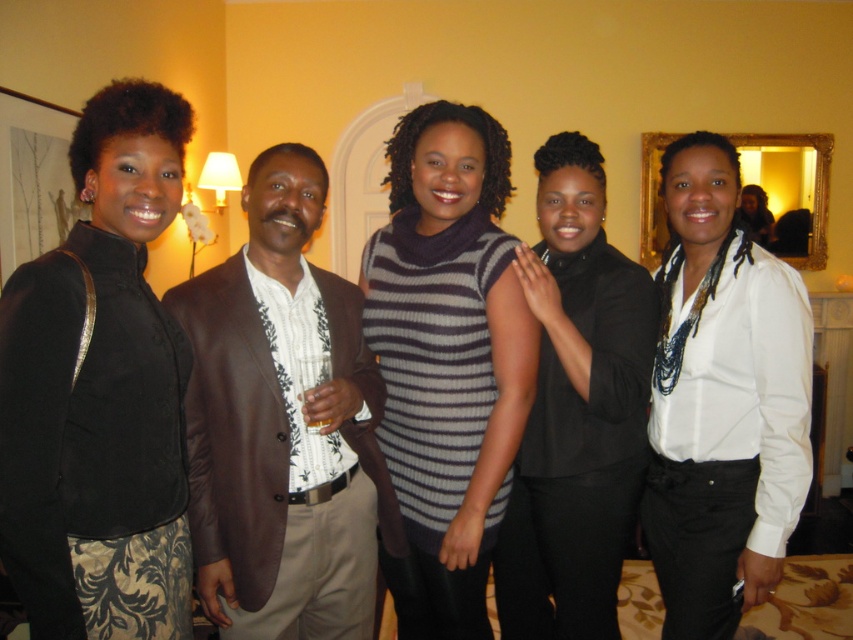
Question: Does striped knit dress at center have a lesser width compared to white silk blouse at center?

Choices:
 (A) yes
 (B) no

Answer: (B)

Question: Which point is farther to the camera?

Choices:
 (A) black matte shirt at center
 (B) white silk blouse at center
 (C) striped knit dress at center

Answer: (B)

Question: Which point appears farthest from the camera in this image?

Choices:
 (A) (622, 525)
 (B) (672, 248)
 (C) (764, 220)

Answer: (C)

Question: Which of the following is the closest to the observer?

Choices:
 (A) brown leather jacket at center
 (B) white silk blouse at center
 (C) black velvet jacket at left

Answer: (C)

Question: In this image, where is brown leather jacket at center located relative to white silk blouse at center?

Choices:
 (A) below
 (B) above

Answer: (A)

Question: Is white satin blouse at center to the left of black matte shirt at center from the viewer's perspective?

Choices:
 (A) yes
 (B) no

Answer: (B)